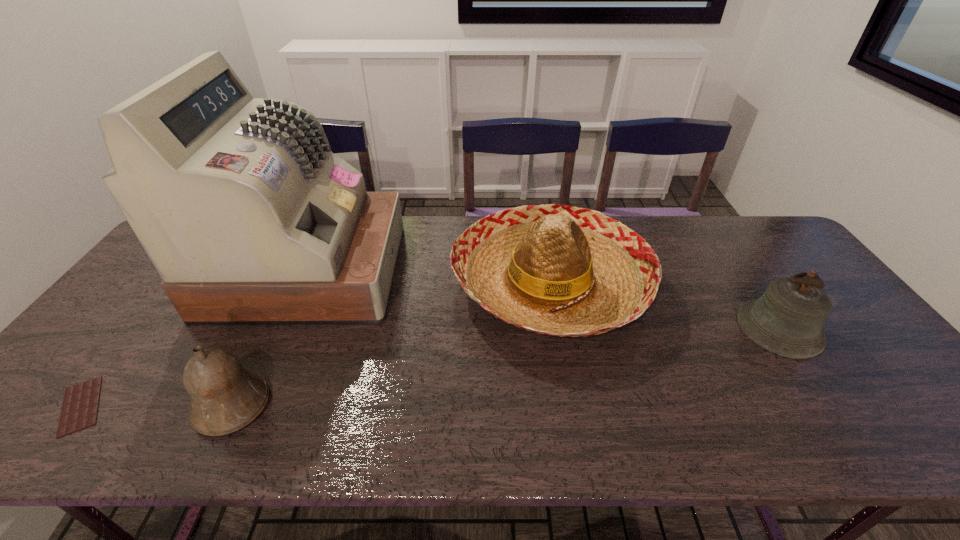
This screenshot has width=960, height=540. Find the location of `free spot between the cash register and the shortest object`. free spot between the cash register and the shortest object is located at coordinates (194, 338).

In order to click on vacant area between the chocolate bar and the sombrero in this screenshot , I will do pos(315,345).

Choose which object is the third nearest neighbor to the cash register. Please provide its 2D coordinates. Your answer should be formatted as a tuple, i.e. [(x, y)], where the tuple contains the x and y coordinates of a point satisfying the conditions above.

[(552, 269)]

I want to click on object that is the third nearest to the fourth object from left to right, so click(225, 397).

Find the location of `vacant region that satisfies the following two spatial constraints: 1. on the back side of the left bell; 2. on the left side of the sombrero`. vacant region that satisfies the following two spatial constraints: 1. on the back side of the left bell; 2. on the left side of the sombrero is located at coordinates (291, 284).

Find the location of `vacant region that satisfies the following two spatial constraints: 1. on the back side of the left bell; 2. on the right side of the fourth object from left to right`. vacant region that satisfies the following two spatial constraints: 1. on the back side of the left bell; 2. on the right side of the fourth object from left to right is located at coordinates (291, 284).

The width and height of the screenshot is (960, 540). Identify the location of vacant space that satisfies the following two spatial constraints: 1. on the back side of the fourth object from left to right; 2. on the operating side of the cash register. (547, 271).

This screenshot has width=960, height=540. Identify the location of free space that satisfies the following two spatial constraints: 1. on the operating side of the cash register; 2. on the right side of the sombrero. click(301, 284).

Find the location of `vacant point that satisfies the following two spatial constraints: 1. on the back side of the second object from right to left; 2. on the right side of the chocolate bar`. vacant point that satisfies the following two spatial constraints: 1. on the back side of the second object from right to left; 2. on the right side of the chocolate bar is located at coordinates (176, 284).

Where is `vacant region that satisfies the following two spatial constraints: 1. on the back side of the sombrero; 2. on the left side of the nearer bell`? vacant region that satisfies the following two spatial constraints: 1. on the back side of the sombrero; 2. on the left side of the nearer bell is located at coordinates (291, 284).